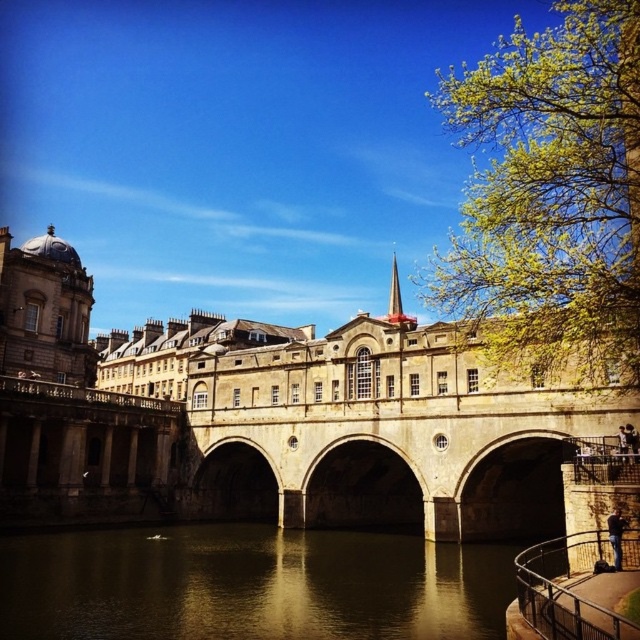
Looking at this image, you are standing at point A located at coordinates 0.5, 0.5 in the image. You want to walk towards the stone bridge at center. Which direction should you move in to reach it?

Since the stone bridge at center is located at coordinates (280, 424), which is to the right and slightly above your current position at (320, 320), you should move towards the northeast direction to reach it.

You are an architect analyzing the image. You need to determine which object occupies more space in the image between the stone bridge at center and the greenish reflective water at center. Based on the scene description, which one is larger?

The stone bridge at center has a larger size compared to the greenish reflective water at center, so the stone bridge at center occupies more space in the image.